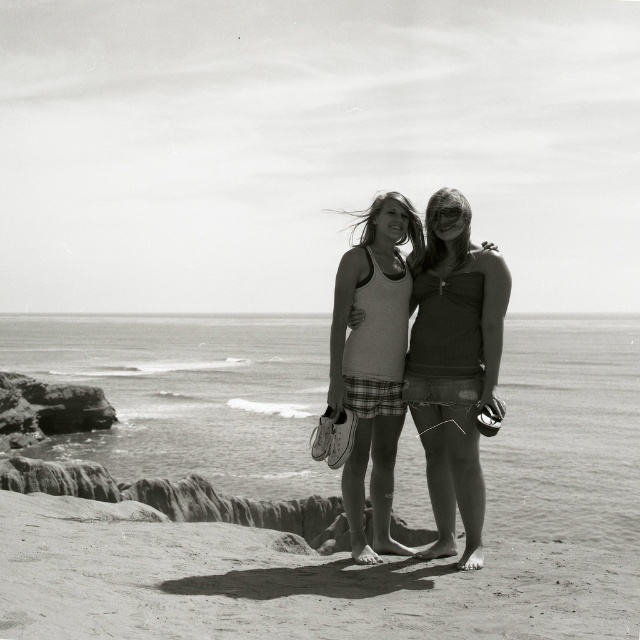
You are a photographer standing on the beach and want to take a photo of the smooth sand at lower center and the matte white tank top at center. If your camera can focus on objects within 10 meters, will both subjects be in focus?

The smooth sand at lower center is 9.60 meters away from matte white tank top at center. Since the distance between them is within the camera focus range of 10 meters, both subjects will be in focus.

You are a photographer trying to capture a shot of the smooth sand at lower center and the matte white tank top at center. Which object should you focus on first if you want to ensure both are in the frame without moving the camera?

The smooth sand at lower center is positioned on the left side of the matte white tank top at center, so you should focus on the smooth sand at lower center first to ensure both are in the frame without moving the camera.

You are a photographer trying to capture the scene from the beach. You want to ensure that both the smooth sand at lower center and the matte white tank top at center are visible in your photo. Based on their positions, which object should appear closer to the camera?

The smooth sand at lower center is in front of the matte white tank top at center, so the smooth sand at lower center would appear closer to the camera.